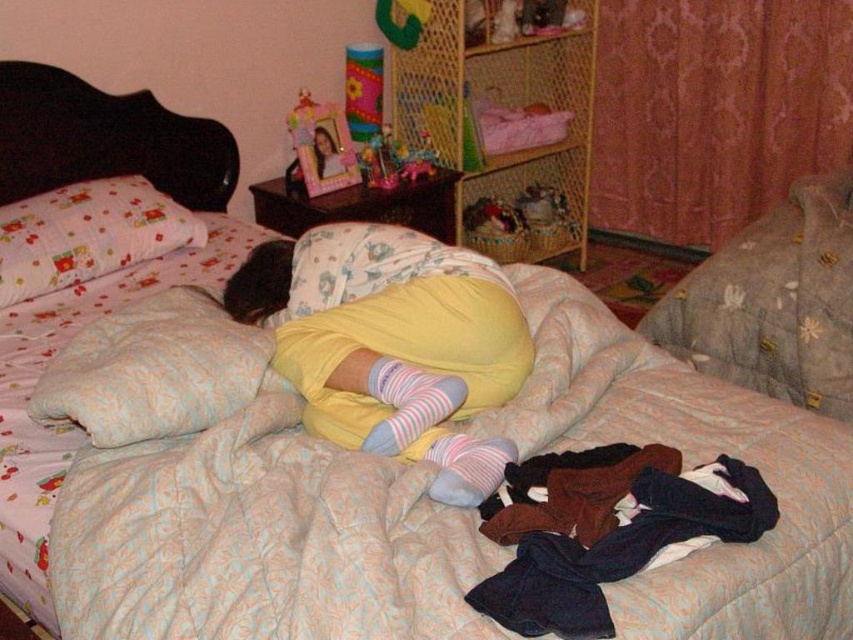
Consider the image. How distant is dark brown cotton shirt at lower right from matte plastic photo frame at upper center?

They are 5.77 feet apart.

Can you confirm if dark brown cotton shirt at lower right is shorter than matte plastic photo frame at upper center?

Indeed, dark brown cotton shirt at lower right has a lesser height compared to matte plastic photo frame at upper center.

Between point (730, 529) and point (300, 141), which one is positioned behind?

Point (300, 141)

At what (x,y) coordinates should I click in order to perform the action: click on dark brown cotton shirt at lower right. Please return your answer as a coordinate pair (x, y). Image resolution: width=853 pixels, height=640 pixels. Looking at the image, I should click on (604, 529).

How much distance is there between yellow cotton shirt at center and fluffy cotton pillow at upper left?

A distance of 32.80 inches exists between yellow cotton shirt at center and fluffy cotton pillow at upper left.

Is point (311, 365) less distant than point (45, 209)?

That is True.

At what (x,y) coordinates should I click in order to perform the action: click on yellow cotton shirt at center. Please return your answer as a coordinate pair (x, y). Looking at the image, I should click on (392, 342).

Does dark brown cotton shirt at lower right have a lesser width compared to plastic pink toy at center?

In fact, dark brown cotton shirt at lower right might be wider than plastic pink toy at center.

Is dark brown cotton shirt at lower right bigger than plastic pink toy at center?

Yes, dark brown cotton shirt at lower right is bigger than plastic pink toy at center.

The width and height of the screenshot is (853, 640). Identify the location of dark brown cotton shirt at lower right. (604, 529).

Image resolution: width=853 pixels, height=640 pixels. What are the coordinates of `dark brown cotton shirt at lower right` in the screenshot? It's located at (604, 529).